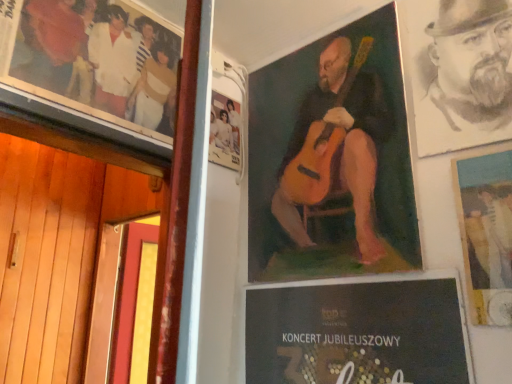
Question: Can you confirm if matte paper poster at upper right, which is the first poster in right-to-left order, is smaller than charcoal sketch of man at upper right?

Choices:
 (A) no
 (B) yes

Answer: (B)

Question: Is the surface of matte paper poster at upper right, the 3th poster from the left, in direct contact with charcoal sketch of man at upper right?

Choices:
 (A) no
 (B) yes

Answer: (A)

Question: Is matte paper poster at upper right, the 3th poster from the left, not inside charcoal sketch of man at upper right?

Choices:
 (A) no
 (B) yes

Answer: (B)

Question: Considering the relative positions of matte paper poster at upper right, which is the first poster in right-to-left order, and charcoal sketch of man at upper right in the image provided, is matte paper poster at upper right, which is the first poster in right-to-left order, to the left of charcoal sketch of man at upper right from the viewer's perspective?

Choices:
 (A) yes
 (B) no

Answer: (B)

Question: Is charcoal sketch of man at upper right inside matte paper poster at upper right, the 3th poster from the left?

Choices:
 (A) yes
 (B) no

Answer: (B)

Question: Is matte paper poster at upper right, the 3th poster from the left, taller than charcoal sketch of man at upper right?

Choices:
 (A) yes
 (B) no

Answer: (B)

Question: Is charcoal sketch of man at upper right taller than matte paper poster at upper right, which is the first poster in right-to-left order?

Choices:
 (A) no
 (B) yes

Answer: (B)

Question: From a real-world perspective, is charcoal sketch of man at upper right located higher than matte paper poster at upper right, which is the first poster in right-to-left order?

Choices:
 (A) no
 (B) yes

Answer: (B)

Question: Is charcoal sketch of man at upper right looking in the opposite direction of matte paper poster at upper right, the 3th poster from the left?

Choices:
 (A) yes
 (B) no

Answer: (B)

Question: From a real-world perspective, is charcoal sketch of man at upper right located beneath matte paper poster at upper right, the 3th poster from the left?

Choices:
 (A) no
 (B) yes

Answer: (A)

Question: From the image's perspective, is charcoal sketch of man at upper right located above matte paper poster at upper right, which is the first poster in right-to-left order?

Choices:
 (A) no
 (B) yes

Answer: (B)

Question: Would you consider charcoal sketch of man at upper right to be distant from matte paper poster at upper right, the 3th poster from the left?

Choices:
 (A) yes
 (B) no

Answer: (B)

Question: Does matte paper poster at upper right, which is the first poster in right-to-left order, have a greater width compared to oil painting guitar at center, which is counted as the 2th poster, starting from the right?

Choices:
 (A) yes
 (B) no

Answer: (A)